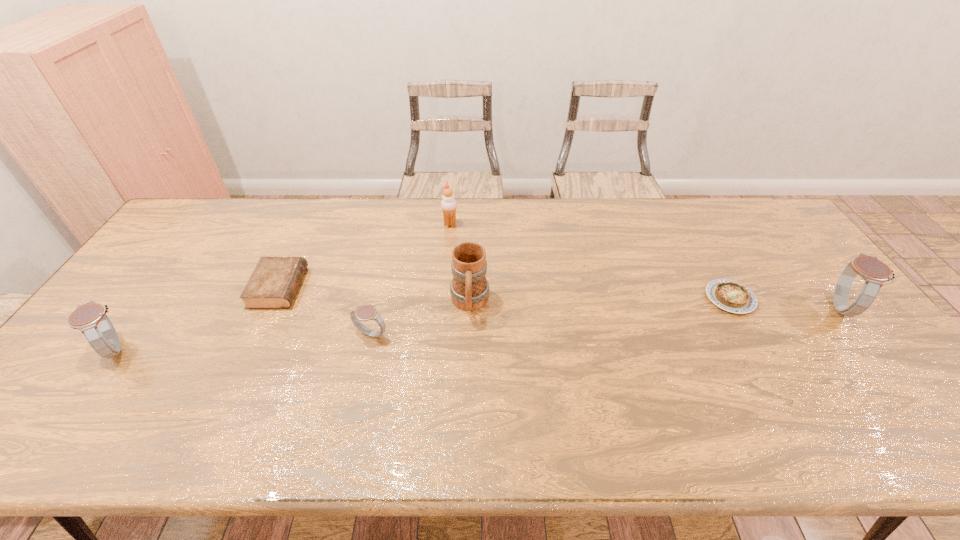
The image size is (960, 540). What are the coordinates of `the second shortest watch` in the screenshot? It's located at (90, 318).

Locate an element on the screen. the leftmost watch is located at coordinates (90, 318).

Identify the location of the fifth tallest object. Image resolution: width=960 pixels, height=540 pixels. (366, 312).

This screenshot has height=540, width=960. Find the location of `the third object from left to right`. the third object from left to right is located at coordinates (366, 312).

At what (x,y) coordinates should I click in order to perform the action: click on the rightmost object. Please return your answer as a coordinate pair (x, y). Looking at the image, I should click on (874, 272).

You are a GUI agent. You are given a task and a screenshot of the screen. Output one action in this format:
    pyautogui.click(x=<x>, y=<y>)
    Task: Click on the icecream
    This screenshot has height=540, width=960.
    Given the screenshot: What is the action you would take?
    pyautogui.click(x=448, y=204)

Locate an element on the screen. Image resolution: width=960 pixels, height=540 pixels. diary is located at coordinates (274, 282).

Image resolution: width=960 pixels, height=540 pixels. I want to click on the second shortest object, so click(274, 282).

The image size is (960, 540). I want to click on the shortest object, so click(x=729, y=295).

Where is `the sixth object from left to right`? The image size is (960, 540). the sixth object from left to right is located at coordinates (729, 295).